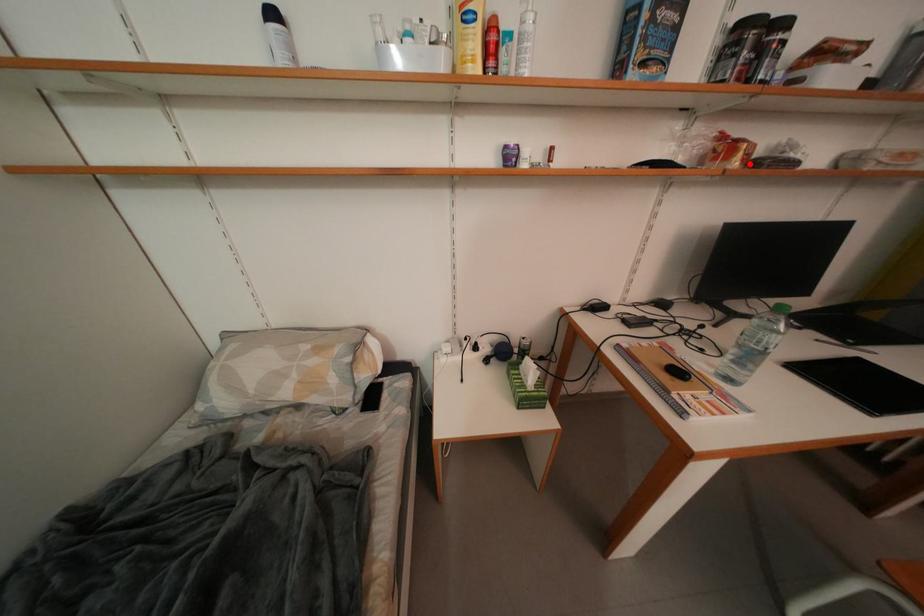
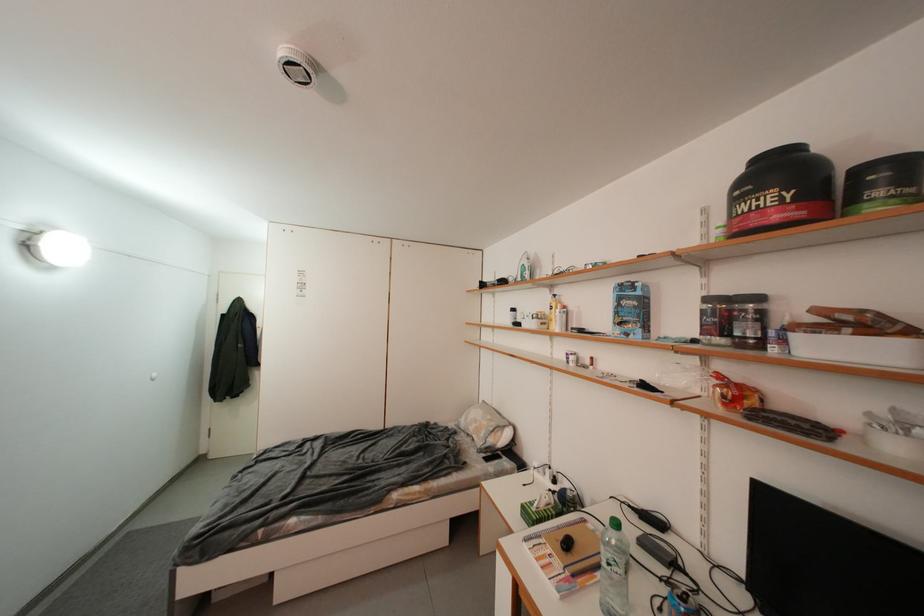
Where in the second image is the point corresponding to the highlighted location from the first image?

(733, 408)